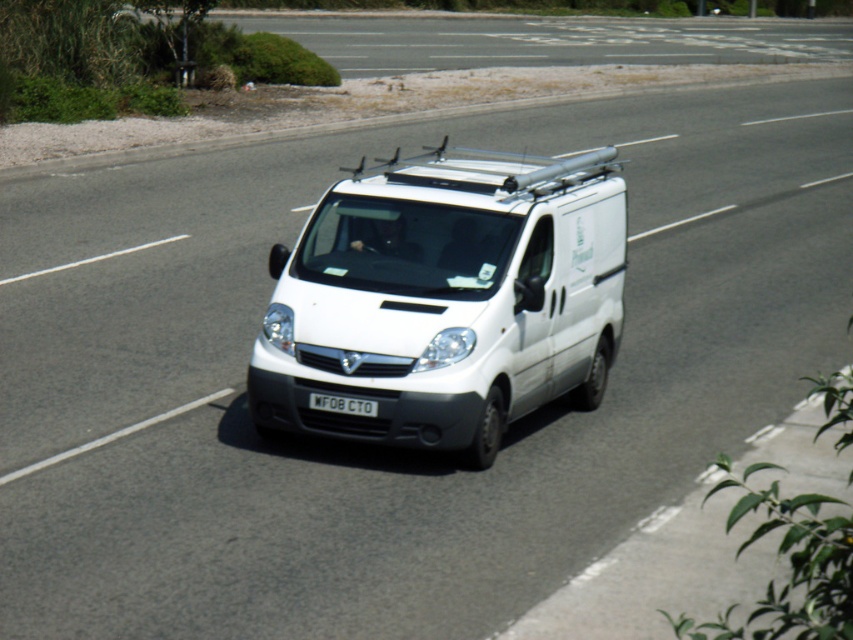
You are a traffic officer checking vehicle dimensions. You observe a white matte van at center with a black plastic license plate at center. According to regulations, the license plate must be at least 30 cm in width. Can you confirm if the license plate meets the minimum width requirement based on the van and license plate sizes?

The white matte van at center is wider than the black plastic license plate at center. Since the van is wider than the license plate, and the regulation requires the license plate to be at least 30 cm wide, it is likely that the license plate meets the requirement. However, without exact measurements, we cannot be certain, but based on the comparison, it probably complies.

You are a delivery driver who needs to park your white matte van at center under a low bridge. The bridge has a height restriction sign indicating a maximum height of 2 meters. Given that the black plastic license plate at center is positioned at ground level, can you estimate if your van will fit under the bridge?

The white matte van at center is much taller than the black plastic license plate at center, which is at ground level. Since the license plate is at ground level and the van is much taller, the van likely exceeds the 2 meter height restriction and may not fit under the bridge.

You are a traffic monitoring system analyzing the position of vehicles on the road. The van is at the center of the road. What is the exact coordinate of the white matte van at center?

The white matte van at center is located at coordinate point (x=445, y=298).